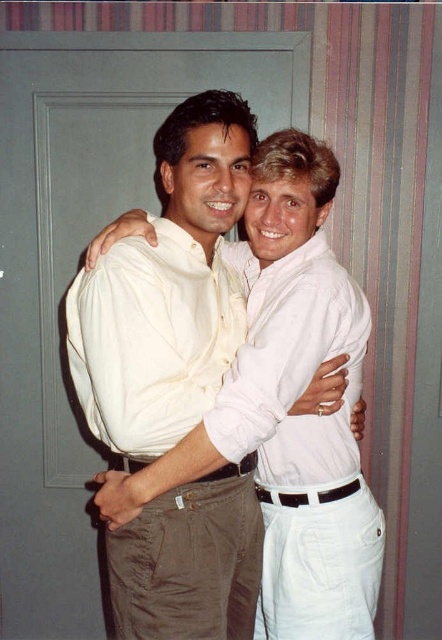
Does point (106, 492) lie behind point (338, 262)?

No, (106, 492) is closer to viewer.

Can you confirm if white cotton shirt at center is positioned to the left of white matte shirt at center?

Yes, white cotton shirt at center is to the left of white matte shirt at center.

Identify the location of white cotton shirt at center. The width and height of the screenshot is (442, 640). (288, 408).

In order to click on white cotton shirt at center in this screenshot , I will do `click(288, 408)`.